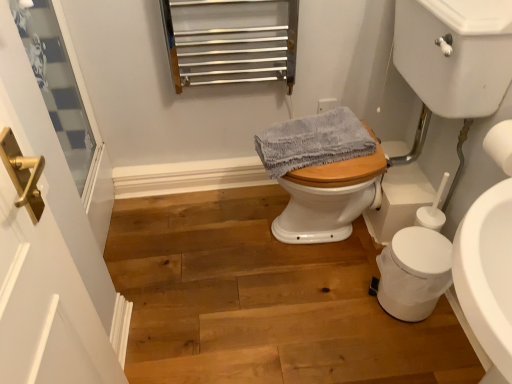
Find the location of a particular element. vacant region above wooden floor at center (from a real-world perspective) is located at coordinates (251, 281).